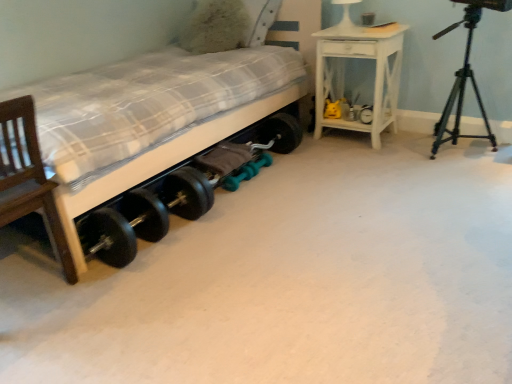
Image resolution: width=512 pixels, height=384 pixels. Describe the element at coordinates (375, 74) in the screenshot. I see `white painted wood nightstand at upper right` at that location.

Locate an element on the screen. The height and width of the screenshot is (384, 512). wooden chair at left is located at coordinates (28, 176).

Describe the element at coordinates (215, 27) in the screenshot. I see `fluffy white pillow at upper center` at that location.

The height and width of the screenshot is (384, 512). Find the location of `fluffy white pillow at upper center`. fluffy white pillow at upper center is located at coordinates [x=215, y=27].

This screenshot has width=512, height=384. I want to click on wooden bed at lower left, so click(157, 134).

Identify the location of chair that is under the white glossy table lamp at upper center (from a real-world perspective). (28, 176).

Considering the sizes of objects white glossy table lamp at upper center and wooden chair at left in the image provided, who is wider, white glossy table lamp at upper center or wooden chair at left?

wooden chair at left.

Between white glossy table lamp at upper center and wooden chair at left, which one is positioned behind?

Positioned behind is white glossy table lamp at upper center.

Is white glossy table lamp at upper center placed right next to wooden chair at left?

There is a gap between white glossy table lamp at upper center and wooden chair at left.

Can you tell me how much white painted wood nightstand at upper right and white glossy table lamp at upper center differ in facing direction?

2.6 degrees separate the facing orientations of white painted wood nightstand at upper right and white glossy table lamp at upper center.

Does white painted wood nightstand at upper right have a smaller size compared to white glossy table lamp at upper center?

Incorrect, white painted wood nightstand at upper right is not smaller in size than white glossy table lamp at upper center.

Where is `table lamp above the white painted wood nightstand at upper right (from a real-world perspective)`? table lamp above the white painted wood nightstand at upper right (from a real-world perspective) is located at coordinates (345, 13).

Considering the relative sizes of black metal tripod at right and fluffy white pillow at upper center in the image provided, is black metal tripod at right bigger than fluffy white pillow at upper center?

Correct, black metal tripod at right is larger in size than fluffy white pillow at upper center.

Find the location of a particular element. pillow that is above the black metal tripod at right (from a real-world perspective) is located at coordinates (215, 27).

Which is behind, point (479, 0) or point (243, 41)?

The point (243, 41) is more distant.

Is black metal tripod at right wider or thinner than fluffy white pillow at upper center?

Clearly, black metal tripod at right has more width compared to fluffy white pillow at upper center.

From the image's perspective, is black metal tripod at right on white painted wood nightstand at upper right?

No, from the image's perspective, black metal tripod at right is not on top of white painted wood nightstand at upper right.

Which object is wider, black metal tripod at right or white painted wood nightstand at upper right?

Wider between the two is black metal tripod at right.

Could you tell me if black metal tripod at right is facing white painted wood nightstand at upper right?

No, black metal tripod at right is not oriented towards white painted wood nightstand at upper right.

Which point is more distant from viewer, [445,124] or [322,104]?

The point [322,104] is farther from the camera.

Where is `tripod in front of the white painted wood nightstand at upper right`? Image resolution: width=512 pixels, height=384 pixels. tripod in front of the white painted wood nightstand at upper right is located at coordinates (465, 77).

Which object is wider, white painted wood nightstand at upper right or black metal tripod at right?

Wider between the two is black metal tripod at right.

Is there a large distance between white painted wood nightstand at upper right and black metal tripod at right?

Actually, white painted wood nightstand at upper right and black metal tripod at right are a little close together.

Based on the photo, is white painted wood nightstand at upper right inside the boundaries of black metal tripod at right, or outside?

white painted wood nightstand at upper right lies outside black metal tripod at right.

The height and width of the screenshot is (384, 512). I want to click on chair located on the left of fluffy white pillow at upper center, so click(x=28, y=176).

Based on the photo, considering the sizes of objects wooden chair at left and fluffy white pillow at upper center in the image provided, who is wider, wooden chair at left or fluffy white pillow at upper center?

With larger width is fluffy white pillow at upper center.

Is wooden chair at left not close to fluffy white pillow at upper center?

Absolutely, wooden chair at left is distant from fluffy white pillow at upper center.

Does point (55, 221) lie behind point (210, 42)?

No, (55, 221) is in front of (210, 42).

From a real-world perspective, which object rests below the other?

wooden chair at left.

Can we say wooden chair at left lies outside white glossy table lamp at upper center?

Absolutely, wooden chair at left is external to white glossy table lamp at upper center.

Is the surface of wooden chair at left in direct contact with white glossy table lamp at upper center?

No.

Considering the positions of objects wooden chair at left and white glossy table lamp at upper center in the image provided, who is more to the left, wooden chair at left or white glossy table lamp at upper center?

wooden chair at left.

This screenshot has height=384, width=512. What are the coordinates of `chair below the white glossy table lamp at upper center (from the image's perspective)` in the screenshot? It's located at (28, 176).

Locate an element on the screen. Image resolution: width=512 pixels, height=384 pixels. nightstand that appears in front of the white glossy table lamp at upper center is located at coordinates (375, 74).

Looking at the image, which one is located further to wooden bed at lower left, wooden chair at left or white painted wood nightstand at upper right?

white painted wood nightstand at upper right lies further to wooden bed at lower left than the other object.

Based on their spatial positions, is fluffy white pillow at upper center or wooden bed at lower left further from wooden chair at left?

The object further to wooden chair at left is fluffy white pillow at upper center.

Estimate the real-world distances between objects in this image. Which object is further from wooden bed at lower left, black metal tripod at right or wooden chair at left?

Based on the image, black metal tripod at right appears to be further to wooden bed at lower left.

Looking at the image, which one is located closer to fluffy white pillow at upper center, white painted wood nightstand at upper right or white glossy table lamp at upper center?

Based on the image, white glossy table lamp at upper center appears to be nearer to fluffy white pillow at upper center.

Based on their spatial positions, is wooden chair at left or white glossy table lamp at upper center closer to black metal tripod at right?

white glossy table lamp at upper center.

Looking at the image, which one is located further to white glossy table lamp at upper center, wooden chair at left or fluffy white pillow at upper center?

wooden chair at left.

Consider the image. Looking at the image, which one is located closer to wooden chair at left, black metal tripod at right or white painted wood nightstand at upper right?

white painted wood nightstand at upper right lies closer to wooden chair at left than the other object.

Which object lies further to the anchor point white painted wood nightstand at upper right, fluffy white pillow at upper center or wooden chair at left?

wooden chair at left lies further to white painted wood nightstand at upper right than the other object.

The image size is (512, 384). I want to click on nightstand between white glossy table lamp at upper center and black metal tripod at right from left to right, so click(375, 74).

The height and width of the screenshot is (384, 512). What are the coordinates of `table lamp between wooden bed at lower left and fluffy white pillow at upper center in the front-back direction` in the screenshot? It's located at (345, 13).

Where is `nightstand between fluffy white pillow at upper center and black metal tripod at right from left to right`? The image size is (512, 384). nightstand between fluffy white pillow at upper center and black metal tripod at right from left to right is located at coordinates (375, 74).

I want to click on pillow between wooden chair at left and white painted wood nightstand at upper right in the horizontal direction, so coord(215,27).